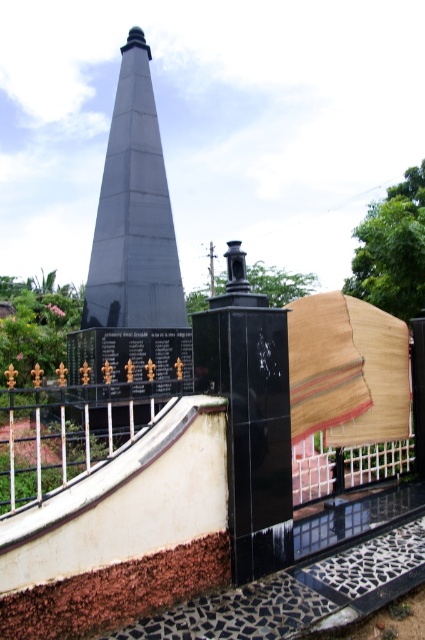
Can you confirm if smooth gray obelisk at center is positioned to the right of gold wrought iron railing at lower left?

In fact, smooth gray obelisk at center is to the left of gold wrought iron railing at lower left.

Is point (108, 227) less distant than point (45, 488)?

No, (108, 227) is behind (45, 488).

I want to click on smooth gray obelisk at center, so click(x=133, y=250).

The width and height of the screenshot is (425, 640). Find the location of `smooth gray obelisk at center`. smooth gray obelisk at center is located at coordinates (x=133, y=250).